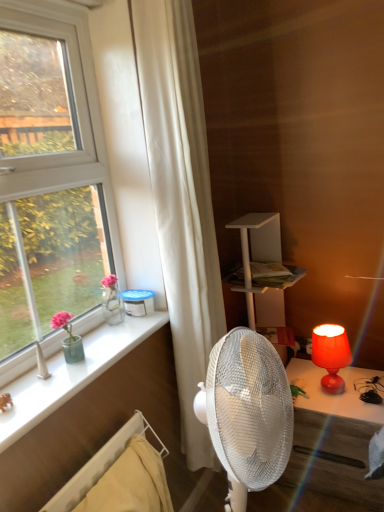
Question: Do you think matte red lamp at right is within white fabric curtain at center, or outside of it?

Choices:
 (A) inside
 (B) outside

Answer: (B)

Question: Does point (344, 359) appear closer or farther from the camera than point (195, 86)?

Choices:
 (A) closer
 (B) farther

Answer: (B)

Question: Which object is positioned farthest from the matte red lamp at right?

Choices:
 (A) white glossy window sill at lower left
 (B) white fabric curtain at center
 (C) white plastic radiator at lower left
 (D) matte red lamp at right

Answer: (C)

Question: Based on their relative distances, which object is nearer to the matte red lamp at right?

Choices:
 (A) white glossy window sill at lower left
 (B) white fabric curtain at center
 (C) matte red lamp at right
 (D) white plastic radiator at lower left

Answer: (C)